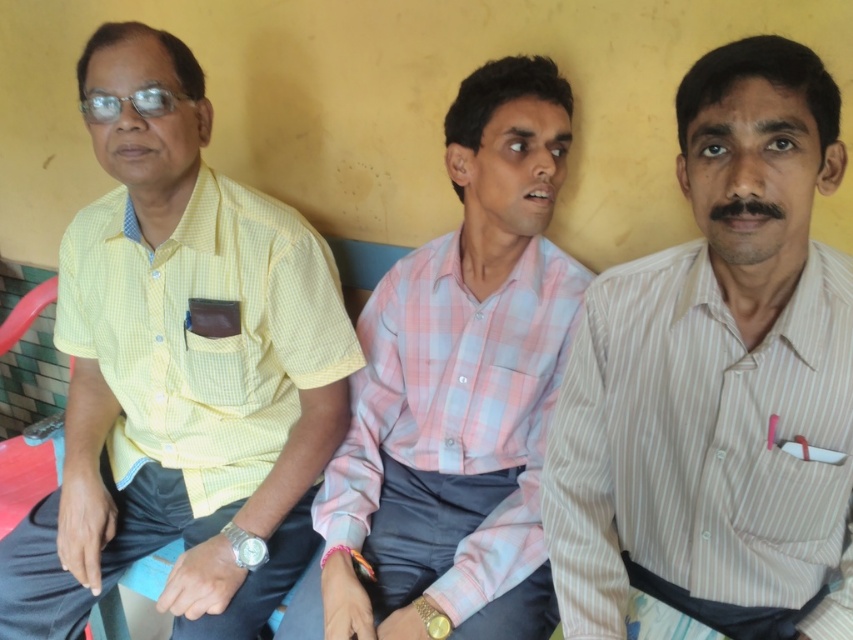
Between yellow checkered shirt at left and pink checkered shirt at center, which one is positioned lower?

pink checkered shirt at center is below.

You are a GUI agent. You are given a task and a screenshot of the screen. Output one action in this format:
    pyautogui.click(x=<x>, y=<y>)
    Task: Click on the yellow checkered shirt at left
    
    Given the screenshot: What is the action you would take?
    pyautogui.click(x=180, y=369)

Where is `yellow checkered shirt at left`? This screenshot has width=853, height=640. yellow checkered shirt at left is located at coordinates (180, 369).

Is yellow checkered shirt at left bigger than white striped shirt at center?

Yes.

Does yellow checkered shirt at left have a greater height compared to white striped shirt at center?

Indeed, yellow checkered shirt at left has a greater height compared to white striped shirt at center.

Between point (223, 406) and point (758, 68), which one is positioned in front?

Positioned in front is point (758, 68).

Where is `yellow checkered shirt at left`? Image resolution: width=853 pixels, height=640 pixels. yellow checkered shirt at left is located at coordinates (180, 369).

Which is more to the right, white striped shirt at center or pink checkered shirt at center?

From the viewer's perspective, white striped shirt at center appears more on the right side.

Can you confirm if white striped shirt at center is positioned above pink checkered shirt at center?

No.

What do you see at coordinates (717, 378) in the screenshot? I see `white striped shirt at center` at bounding box center [717, 378].

Find the location of `white striped shirt at center`. white striped shirt at center is located at coordinates (717, 378).